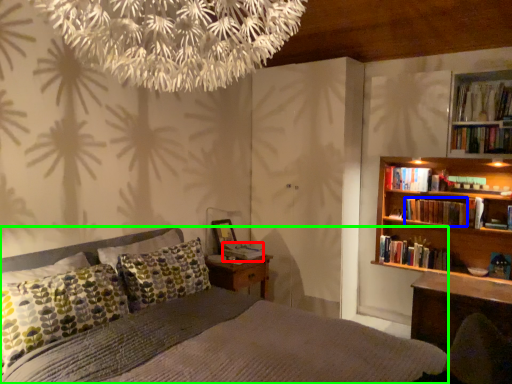
Question: Based on their relative distances, which object is nearer to book (highlighted by a red box)? Choose from book (highlighted by a blue box) and bed (highlighted by a green box).

Choices:
 (A) book
 (B) bed

Answer: (B)